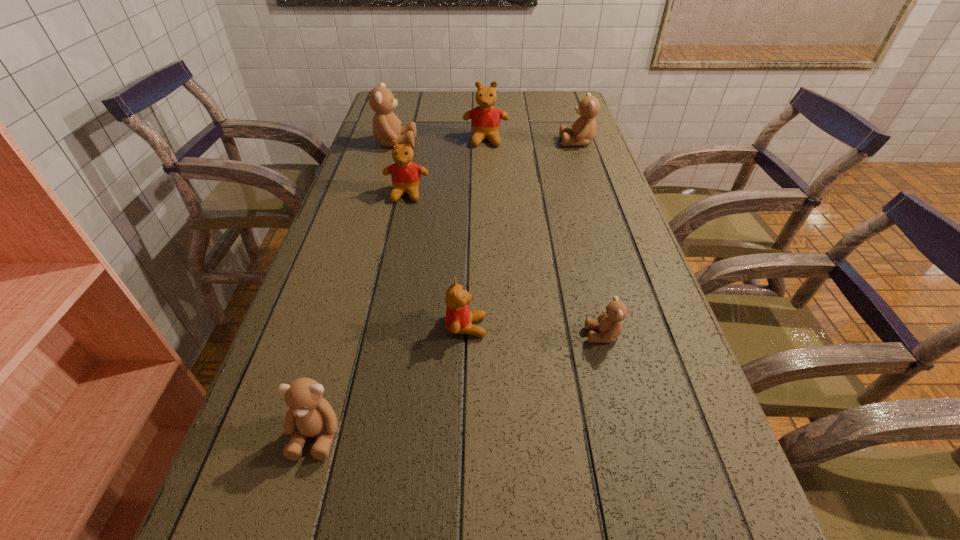
At what (x,y) coordinates should I click in order to perform the action: click on unoccupied area between the farthest red teddy bear and the nearest red teddy bear. Please return your answer as a coordinate pair (x, y). The width and height of the screenshot is (960, 540). Looking at the image, I should click on (476, 233).

At what (x,y) coordinates should I click in order to perform the action: click on vacant space that's between the biggest brown teddy bear and the smallest brown teddy bear. Please return your answer as a coordinate pair (x, y). The image size is (960, 540). Looking at the image, I should click on (499, 239).

You are a GUI agent. You are given a task and a screenshot of the screen. Output one action in this format:
    pyautogui.click(x=<x>, y=<y>)
    Task: Click on the free space that is in between the nearest teddy bear and the leftmost red teddy bear
    The height and width of the screenshot is (540, 960).
    Given the screenshot: What is the action you would take?
    pyautogui.click(x=361, y=314)

This screenshot has height=540, width=960. Find the location of `object that is the fifth closest to the nearest object`. object that is the fifth closest to the nearest object is located at coordinates (485, 119).

Locate which object ranks third in proximity to the nearest red teddy bear. Please provide its 2D coordinates. Your answer should be formatted as a tuple, i.e. [(x, y)], where the tuple contains the x and y coordinates of a point satisfying the conditions above.

[(405, 174)]

Image resolution: width=960 pixels, height=540 pixels. What are the coordinates of `teddy bear that can be found as the fourth closest to the biggest brown teddy bear` in the screenshot? It's located at (459, 319).

Identify which teddy bear is the fifth closest to the second biggest brown teddy bear. Please provide its 2D coordinates. Your answer should be formatted as a tuple, i.e. [(x, y)], where the tuple contains the x and y coordinates of a point satisfying the conditions above.

[(459, 319)]

Identify which brown teddy bear is located as the third nearest to the third farthest brown teddy bear. Please provide its 2D coordinates. Your answer should be formatted as a tuple, i.e. [(x, y)], where the tuple contains the x and y coordinates of a point satisfying the conditions above.

[(386, 126)]

Select which brown teddy bear is the closest to the third biggest brown teddy bear. Please provide its 2D coordinates. Your answer should be formatted as a tuple, i.e. [(x, y)], where the tuple contains the x and y coordinates of a point satisfying the conditions above.

[(609, 324)]

At what (x,y) coordinates should I click in order to perform the action: click on red teddy bear that is the nearest to the leftmost red teddy bear. Please return your answer as a coordinate pair (x, y). This screenshot has height=540, width=960. Looking at the image, I should click on (485, 119).